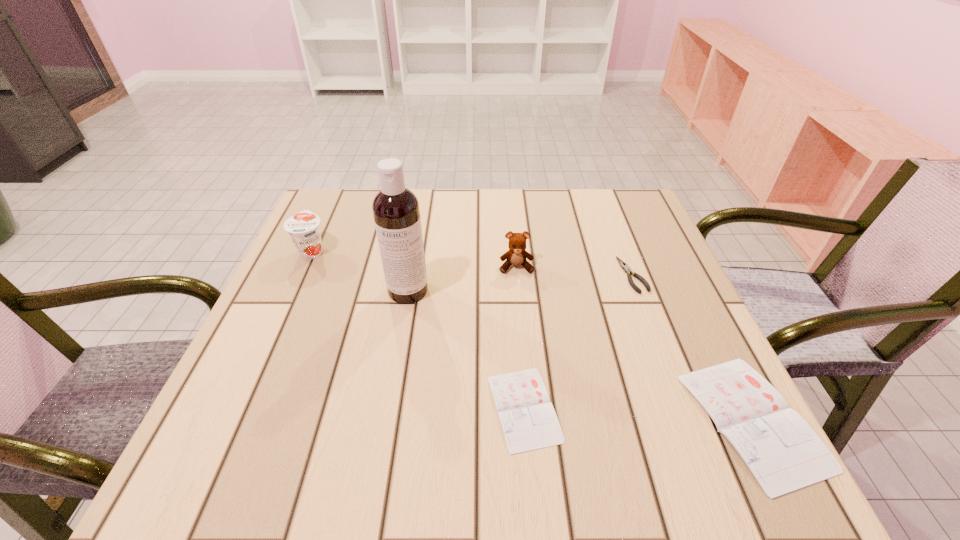
With all diarys evenly spaced, where should an extra diary be placed on the left to continue the pattern? Please point out a vacant space. Please provide its 2D coordinates. Your answer should be formatted as a tuple, i.e. [(x, y)], where the tuple contains the x and y coordinates of a point satisfying the conditions above.

[(305, 396)]